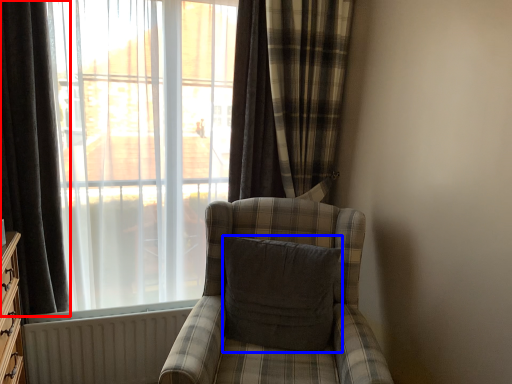
Question: Which of the following is the farthest to the observer, curtain (highlighted by a red box) or pillow (highlighted by a blue box)?

Choices:
 (A) curtain
 (B) pillow

Answer: (B)